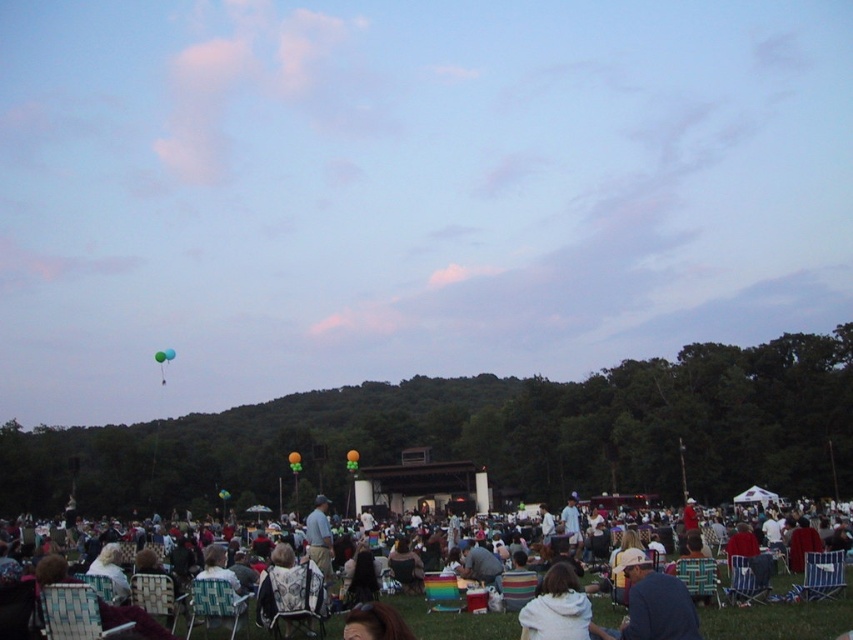
Is point (312, 561) in front of point (166, 356)?

Yes, it is.

Is gray fabric shirt at center above blue glossy balloon at upper center?

Incorrect, gray fabric shirt at center is not positioned above blue glossy balloon at upper center.

Who is more forward, (316, 500) or (161, 353)?

Point (316, 500) is in front.

You are a GUI agent. You are given a task and a screenshot of the screen. Output one action in this format:
    pyautogui.click(x=<x>, y=<y>)
    Task: Click on the gray fabric shirt at center
    
    Given the screenshot: What is the action you would take?
    pyautogui.click(x=318, y=536)

Who is positioned more to the left, white striped shirt at center or blue fabric jacket at lower right?

Positioned to the left is white striped shirt at center.

What are the coordinates of `white striped shirt at center` in the screenshot? It's located at (780, 618).

Measure the distance between point (775,616) and camera.

Point (775,616) and camera are 37.25 meters apart from each other.

At what (x,y) coordinates should I click in order to perform the action: click on white striped shirt at center. Please return your answer as a coordinate pair (x, y). Looking at the image, I should click on (780, 618).

Who is more forward, [323,508] or [170,358]?

Positioned in front is point [323,508].

Can you confirm if gray fabric shirt at center is wider than green rubber balloon at upper center?

No, gray fabric shirt at center is not wider than green rubber balloon at upper center.

Which is in front, point (314, 524) or point (171, 358)?

Positioned in front is point (314, 524).

The height and width of the screenshot is (640, 853). Identify the location of gray fabric shirt at center. (318, 536).